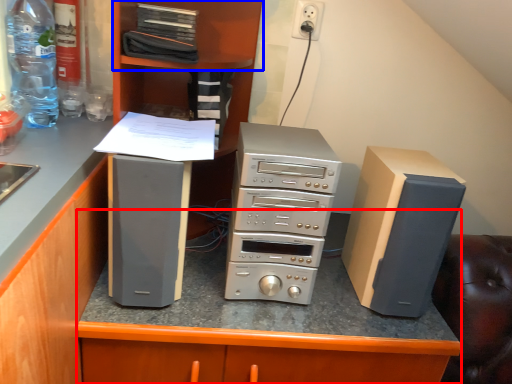
Question: Which object appears closest to the camera in this image, table (highlighted by a red box) or shelf (highlighted by a blue box)?

Choices:
 (A) table
 (B) shelf

Answer: (A)